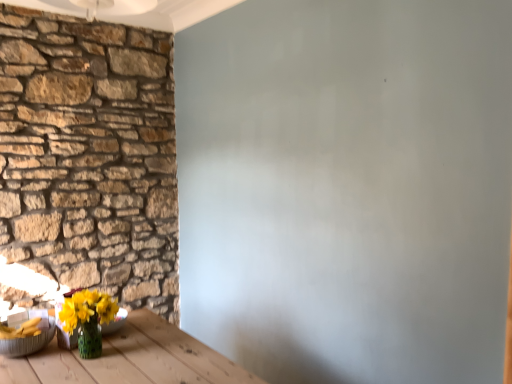
The width and height of the screenshot is (512, 384). Describe the element at coordinates (26, 333) in the screenshot. I see `metallic silver bowl at lower left, the first bowl from the left` at that location.

The image size is (512, 384). Find the location of `natural stone wall at left`. natural stone wall at left is located at coordinates (90, 156).

Measure the distance from translucent glass vase at lower left, which appears as the 2th bowl when viewed from the left, to metallic silver bowl at lower left, the first bowl from the left.

translucent glass vase at lower left, which appears as the 2th bowl when viewed from the left, and metallic silver bowl at lower left, the first bowl from the left, are 14.96 centimeters apart from each other.

Could metallic silver bowl at lower left, which is the second bowl in right-to-left order, be considered to be inside translucent glass vase at lower left, positioned as the 1th bowl in right-to-left order?

Actually, metallic silver bowl at lower left, which is the second bowl in right-to-left order, is outside translucent glass vase at lower left, positioned as the 1th bowl in right-to-left order.

In the scene shown: Which is closer, (56, 306) or (1, 351)?

Clearly, point (56, 306) is more distant from the camera than point (1, 351).

From the image's perspective, is translucent glass vase at lower left, positioned as the 1th bowl in right-to-left order, on metallic silver bowl at lower left, which is the second bowl in right-to-left order?

No, from the image's perspective, translucent glass vase at lower left, positioned as the 1th bowl in right-to-left order, is not above metallic silver bowl at lower left, which is the second bowl in right-to-left order.

Where is `brick above the translucent glass vase at lower left, which appears as the 2th bowl when viewed from the left (from the image's perspective)`? This screenshot has height=384, width=512. brick above the translucent glass vase at lower left, which appears as the 2th bowl when viewed from the left (from the image's perspective) is located at coordinates (90, 156).

Between natural stone wall at left and translucent glass vase at lower left, positioned as the 1th bowl in right-to-left order, which one has smaller size?

translucent glass vase at lower left, positioned as the 1th bowl in right-to-left order.

In the scene shown: From a real-world perspective, who is located lower, natural stone wall at left or translucent glass vase at lower left, positioned as the 1th bowl in right-to-left order?

translucent glass vase at lower left, positioned as the 1th bowl in right-to-left order.

Which object is closer to the camera taking this photo, natural stone wall at left or translucent glass vase at lower left, positioned as the 1th bowl in right-to-left order?

translucent glass vase at lower left, positioned as the 1th bowl in right-to-left order, is in front.

Considering the relative sizes of translucent glass vase at lower left, which appears as the 2th bowl when viewed from the left, and natural stone wall at left in the image provided, is translucent glass vase at lower left, which appears as the 2th bowl when viewed from the left, taller than natural stone wall at left?

No, translucent glass vase at lower left, which appears as the 2th bowl when viewed from the left, is not taller than natural stone wall at left.

In the scene shown: How far apart are translucent glass vase at lower left, which appears as the 2th bowl when viewed from the left, and natural stone wall at left?

translucent glass vase at lower left, which appears as the 2th bowl when viewed from the left, is 4.07 feet from natural stone wall at left.

Who is smaller, translucent glass vase at lower left, which appears as the 2th bowl when viewed from the left, or natural stone wall at left?

translucent glass vase at lower left, which appears as the 2th bowl when viewed from the left.

Which bowl is the 1st one when counting from the front of the natural stone wall at left? Please provide its 2D coordinates.

[(115, 322)]

Which object is more forward, metallic silver bowl at lower left, which is the second bowl in right-to-left order, or translucent glass vase at lower left, which appears as the 2th bowl when viewed from the left?

metallic silver bowl at lower left, which is the second bowl in right-to-left order, is in front.

Considering the sizes of metallic silver bowl at lower left, the first bowl from the left, and translucent glass vase at lower left, which appears as the 2th bowl when viewed from the left, in the image, is metallic silver bowl at lower left, the first bowl from the left, wider or thinner than translucent glass vase at lower left, which appears as the 2th bowl when viewed from the left,?

metallic silver bowl at lower left, the first bowl from the left, is thinner than translucent glass vase at lower left, which appears as the 2th bowl when viewed from the left.

Considering the positions of objects metallic silver bowl at lower left, which is the second bowl in right-to-left order, and translucent glass vase at lower left, which appears as the 2th bowl when viewed from the left, in the image provided, who is more to the right, metallic silver bowl at lower left, which is the second bowl in right-to-left order, or translucent glass vase at lower left, which appears as the 2th bowl when viewed from the left,?

translucent glass vase at lower left, which appears as the 2th bowl when viewed from the left.

From the picture: From a real-world perspective, which is physically below, metallic silver bowl at lower left, the first bowl from the left, or translucent glass vase at lower left, positioned as the 1th bowl in right-to-left order?

In real-world perspective, translucent glass vase at lower left, positioned as the 1th bowl in right-to-left order, is lower.

Is natural stone wall at left oriented towards metallic silver bowl at lower left, which is the second bowl in right-to-left order?

Yes, natural stone wall at left faces towards metallic silver bowl at lower left, which is the second bowl in right-to-left order.

Which of these two, natural stone wall at left or metallic silver bowl at lower left, the first bowl from the left, stands shorter?

Standing shorter between the two is metallic silver bowl at lower left, the first bowl from the left.

Can you tell me how much natural stone wall at left and metallic silver bowl at lower left, the first bowl from the left, differ in facing direction?

natural stone wall at left and metallic silver bowl at lower left, the first bowl from the left, are facing 2.73 degrees away from each other.

Does natural stone wall at left lie in front of metallic silver bowl at lower left, the first bowl from the left?

No, natural stone wall at left is further to the viewer.

Is natural stone wall at left a part of metallic silver bowl at lower left, the first bowl from the left?

No, metallic silver bowl at lower left, the first bowl from the left, does not contain natural stone wall at left.

Is metallic silver bowl at lower left, the first bowl from the left, placed right next to natural stone wall at left?

No, metallic silver bowl at lower left, the first bowl from the left, is not next to natural stone wall at left.

From the picture: Is metallic silver bowl at lower left, the first bowl from the left, wider or thinner than natural stone wall at left?

metallic silver bowl at lower left, the first bowl from the left, is wider than natural stone wall at left.

From a real-world perspective, does metallic silver bowl at lower left, the first bowl from the left, sit lower than natural stone wall at left?

Yes, from a real-world perspective, metallic silver bowl at lower left, the first bowl from the left, is below natural stone wall at left.

Where is `bowl lying on the left of translucent glass vase at lower left, positioned as the 1th bowl in right-to-left order`? This screenshot has width=512, height=384. bowl lying on the left of translucent glass vase at lower left, positioned as the 1th bowl in right-to-left order is located at coordinates (26, 333).

Identify the location of brick located above the translucent glass vase at lower left, which appears as the 2th bowl when viewed from the left (from a real-world perspective). This screenshot has height=384, width=512. (90, 156).

Considering their positions, is translucent glass vase at lower left, positioned as the 1th bowl in right-to-left order, positioned further to natural stone wall at left than metallic silver bowl at lower left, which is the second bowl in right-to-left order?

A: Based on the image, translucent glass vase at lower left, positioned as the 1th bowl in right-to-left order, appears to be further to natural stone wall at left.

Looking at the image, which one is located closer to metallic silver bowl at lower left, which is the second bowl in right-to-left order, natural stone wall at left or translucent glass vase at lower left, positioned as the 1th bowl in right-to-left order?

translucent glass vase at lower left, positioned as the 1th bowl in right-to-left order, is positioned closer to the anchor metallic silver bowl at lower left, which is the second bowl in right-to-left order.

When comparing their distances from natural stone wall at left, does metallic silver bowl at lower left, which is the second bowl in right-to-left order, or translucent glass vase at lower left, which appears as the 2th bowl when viewed from the left, seem further?

Among the two, translucent glass vase at lower left, which appears as the 2th bowl when viewed from the left, is located further to natural stone wall at left.

Estimate the real-world distances between objects in this image. Which object is further from translucent glass vase at lower left, which appears as the 2th bowl when viewed from the left, metallic silver bowl at lower left, which is the second bowl in right-to-left order, or natural stone wall at left?

natural stone wall at left.

Estimate the real-world distances between objects in this image. Which object is further from metallic silver bowl at lower left, which is the second bowl in right-to-left order, translucent glass vase at lower left, which appears as the 2th bowl when viewed from the left, or natural stone wall at left?

Among the two, natural stone wall at left is located further to metallic silver bowl at lower left, which is the second bowl in right-to-left order.

Looking at the image, which one is located further to translucent glass vase at lower left, positioned as the 1th bowl in right-to-left order, natural stone wall at left or metallic silver bowl at lower left, which is the second bowl in right-to-left order?

natural stone wall at left.

I want to click on bowl between natural stone wall at left and translucent glass vase at lower left, which appears as the 2th bowl when viewed from the left, in the up-down direction, so click(x=26, y=333).